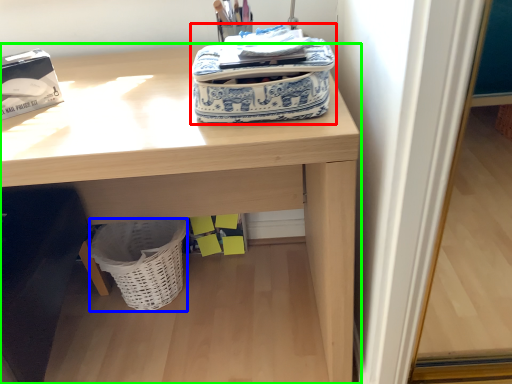
Question: Based on their relative distances, which object is farther from bag (highlighted by a red box)? Choose from basket (highlighted by a blue box) and desk (highlighted by a green box).

Choices:
 (A) basket
 (B) desk

Answer: (A)